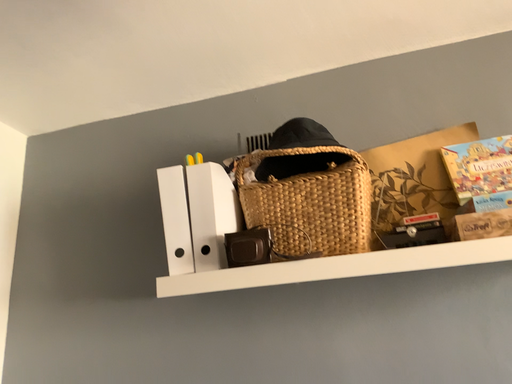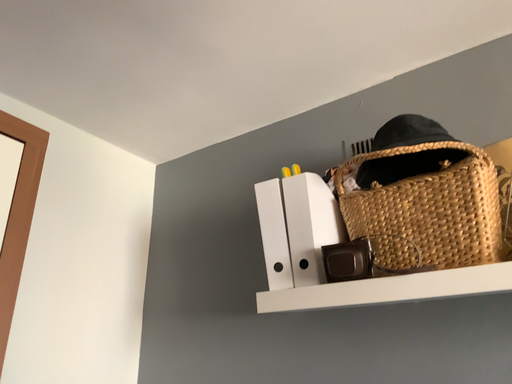
Question: Which way did the camera rotate in the video?

Choices:
 (A) rotated left
 (B) rotated right

Answer: (A)